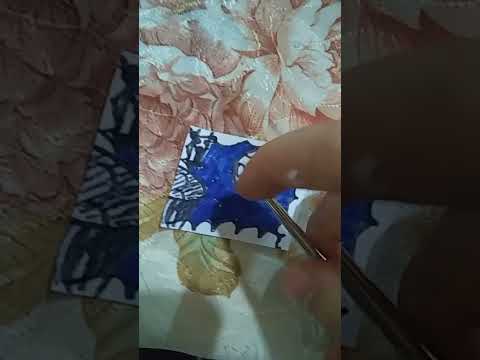
I want to click on painting in covered by dark overlay, so click(111, 205).